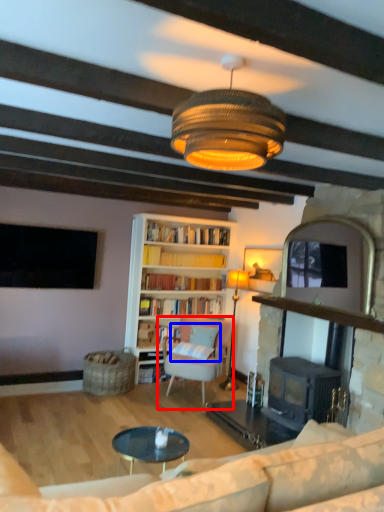
Question: Which object appears farthest to the camera in this image, chair (highlighted by a red box) or pillow (highlighted by a blue box)?

Choices:
 (A) chair
 (B) pillow

Answer: (B)